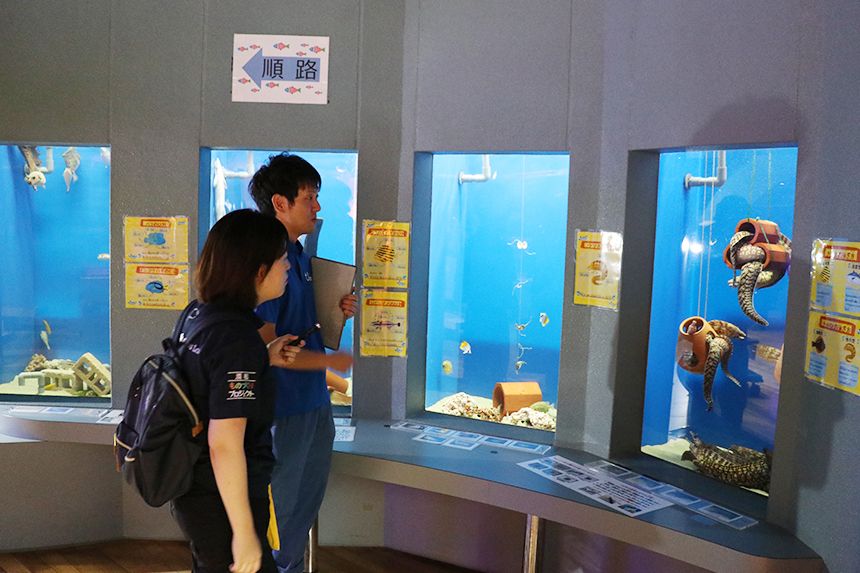
Identify the location of aquarium tank. The image size is (860, 573). [x=716, y=208], [x=520, y=245], [x=327, y=164], [x=54, y=238].